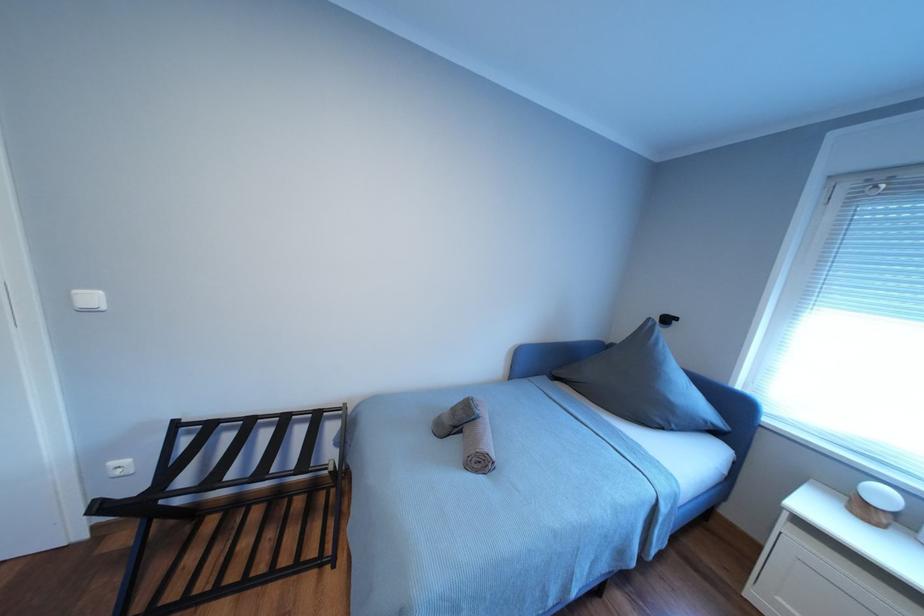
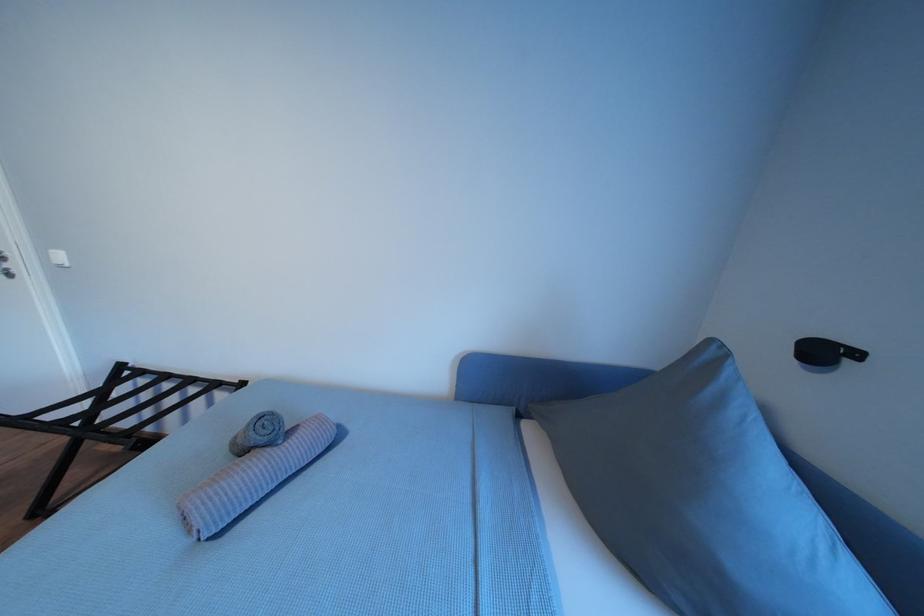
From the picture: The images are taken continuously from a first-person perspective. In which direction are you moving?

The cameraman moved toward right, forward.